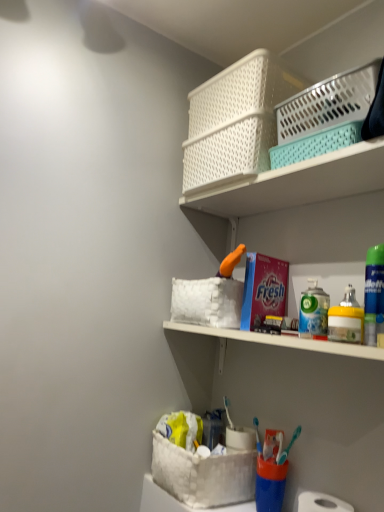
Question: Is white matte toilet paper at lower right wider than white plastic basket at upper center?

Choices:
 (A) no
 (B) yes

Answer: (A)

Question: Is white plastic basket at upper center a part of white matte toilet paper at lower right?

Choices:
 (A) yes
 (B) no

Answer: (B)

Question: Is white matte toilet paper at lower right taller than white plastic basket at upper center?

Choices:
 (A) yes
 (B) no

Answer: (B)

Question: Can you confirm if white matte toilet paper at lower right is shorter than white plastic basket at upper center?

Choices:
 (A) no
 (B) yes

Answer: (B)

Question: From a real-world perspective, is white matte toilet paper at lower right over white plastic basket at upper center?

Choices:
 (A) yes
 (B) no

Answer: (B)

Question: From the image's perspective, relative to white matte toilet paper at lower right, is white plastic basket at upper right, the second basket container when ordered from bottom to top, above or below?

Choices:
 (A) above
 (B) below

Answer: (A)

Question: Considering their positions, is white plastic basket at upper right, positioned as the 2th basket container in top-to-bottom order, located in front of or behind white matte toilet paper at lower right?

Choices:
 (A) front
 (B) behind

Answer: (A)

Question: From a real-world perspective, is white plastic basket at upper right, the second basket container when ordered from bottom to top, above or below white matte toilet paper at lower right?

Choices:
 (A) below
 (B) above

Answer: (B)

Question: Would you say white plastic basket at upper right, the second basket container when ordered from bottom to top, is to the left or to the right of white matte toilet paper at lower right in the picture?

Choices:
 (A) left
 (B) right

Answer: (B)

Question: Relative to white matte toilet paper at lower right, is white fabric basket at lower center, the first basket container in the bottom-to-top sequence, in front or behind?

Choices:
 (A) front
 (B) behind

Answer: (B)

Question: In terms of size, does white fabric basket at lower center, which is counted as the 3th basket container, starting from the top, appear bigger or smaller than white matte toilet paper at lower right?

Choices:
 (A) big
 (B) small

Answer: (A)

Question: From the image's perspective, is white fabric basket at lower center, the first basket container in the bottom-to-top sequence, above or below white matte toilet paper at lower right?

Choices:
 (A) below
 (B) above

Answer: (B)

Question: In terms of height, does white fabric basket at lower center, which is counted as the 3th basket container, starting from the top, look taller or shorter compared to white matte toilet paper at lower right?

Choices:
 (A) tall
 (B) short

Answer: (A)

Question: Is yellow matte spray can at right bigger or smaller than metallic silver mouthwash at shelf right, which ranks as the 2th mouthwash in front-to-back order?

Choices:
 (A) small
 (B) big

Answer: (B)

Question: From the image's perspective, is yellow matte spray can at right above or below metallic silver mouthwash at shelf right, which ranks as the 2th mouthwash in right-to-left order?

Choices:
 (A) below
 (B) above

Answer: (A)